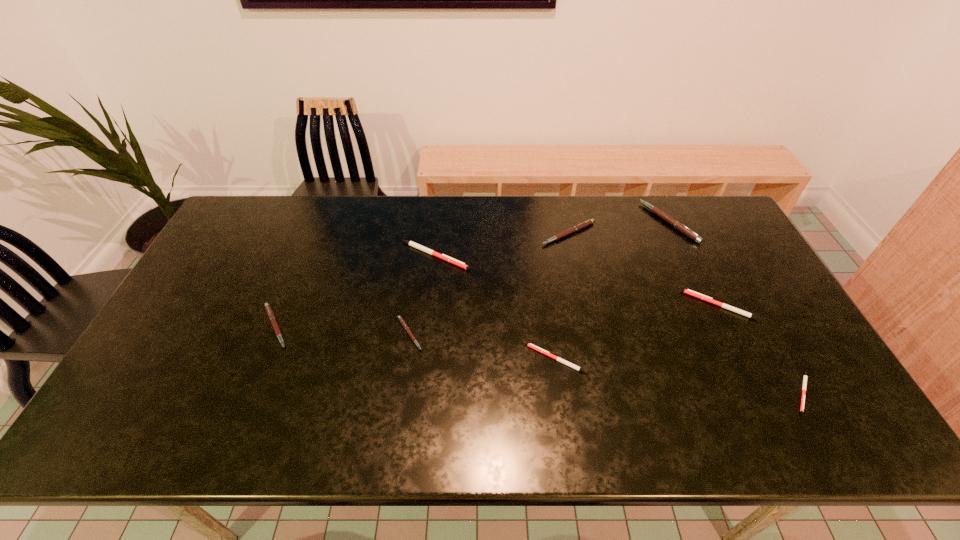
This screenshot has height=540, width=960. Find the location of `vacant space at the near edge of the desktop`. vacant space at the near edge of the desktop is located at coordinates (337, 444).

Locate an element on the screen. free space at the left edge of the desktop is located at coordinates (169, 385).

The width and height of the screenshot is (960, 540). In the image, there is a desktop. In order to click on vacant region at the right edge in this screenshot , I will do `click(816, 360)`.

Locate an element on the screen. This screenshot has width=960, height=540. vacant space at the far right corner is located at coordinates (682, 202).

At what (x,y) coordinates should I click in order to perform the action: click on vacant space at the near right corner. Please return your answer as a coordinate pair (x, y). Looking at the image, I should click on (791, 436).

Find the location of a particular element. Image resolution: width=960 pixels, height=540 pixels. unoccupied area between the second biggest white pen and the leftmost pen is located at coordinates (497, 316).

Locate an element on the screen. free space between the tallest pen and the third biggest white pen is located at coordinates (612, 291).

Locate an element on the screen. Image resolution: width=960 pixels, height=540 pixels. free space between the biggest pink pen and the second biggest white pen is located at coordinates (694, 264).

The image size is (960, 540). I want to click on vacant region between the smallest white pen and the second farthest white pen, so click(x=761, y=349).

You are a GUI agent. You are given a task and a screenshot of the screen. Output one action in this format:
    pyautogui.click(x=<x>, y=<y>)
    Task: Click on the free space between the second biggest pink pen and the smallest white pen
    This screenshot has height=540, width=960.
    Given the screenshot: What is the action you would take?
    pyautogui.click(x=685, y=313)